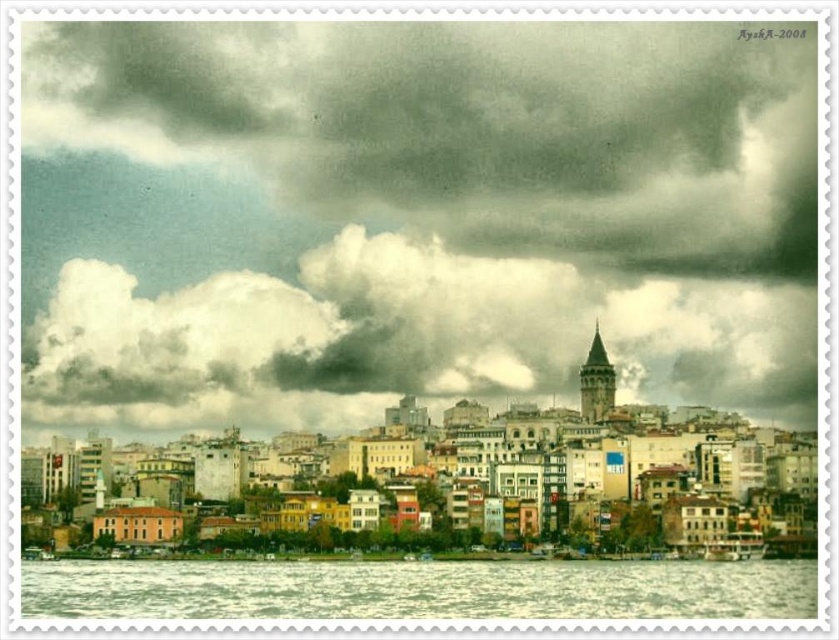
Question: Does cloudy sky at upper center appear under clear water at lower center?

Choices:
 (A) yes
 (B) no

Answer: (B)

Question: Does cloudy sky at upper center have a greater width compared to clear water at lower center?

Choices:
 (A) yes
 (B) no

Answer: (A)

Question: Which of the following is the farthest from the observer?

Choices:
 (A) (196, 611)
 (B) (133, 344)

Answer: (B)

Question: Is cloudy sky at upper center to the left of clear water at lower center from the viewer's perspective?

Choices:
 (A) yes
 (B) no

Answer: (A)

Question: Which object appears farthest from the camera in this image?

Choices:
 (A) clear water at lower center
 (B) cloudy sky at upper center

Answer: (B)

Question: Which object is farther from the camera taking this photo?

Choices:
 (A) clear water at lower center
 (B) cloudy sky at upper center

Answer: (B)